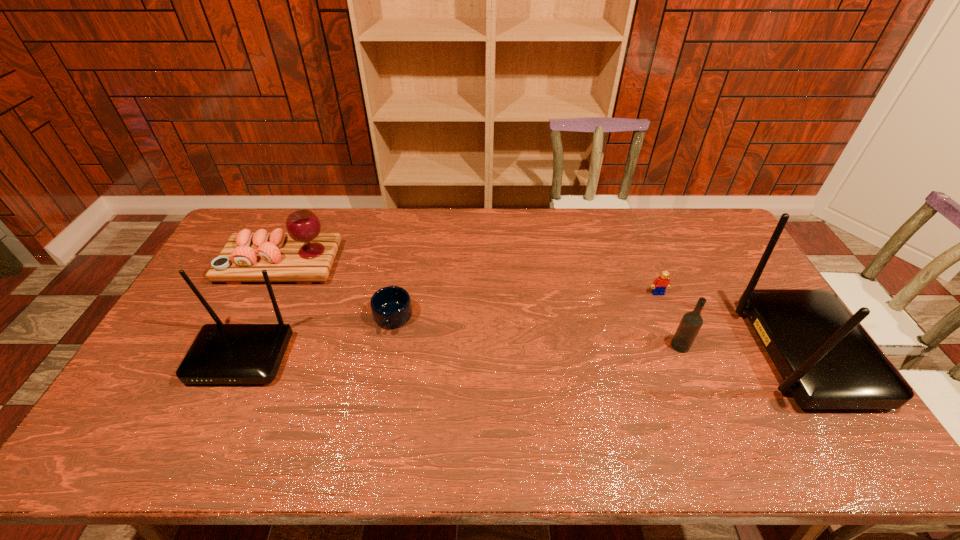
The height and width of the screenshot is (540, 960). What are the coordinates of `free space located 0.070m on the front-facing side of the left router` in the screenshot? It's located at (216, 411).

Where is `vacant space located with the handle on the side of the shortest object`? vacant space located with the handle on the side of the shortest object is located at coordinates (385, 360).

You are a GUI agent. You are given a task and a screenshot of the screen. Output one action in this format:
    pyautogui.click(x=<x>, y=<y>)
    Task: Click on the vacant space situated 0.060m on the front-facing side of the fifth nearest object
    
    Given the screenshot: What is the action you would take?
    pyautogui.click(x=664, y=310)

At what (x,y) coordinates should I click in order to perform the action: click on free point located on the left of the vodka. Please return your answer as a coordinate pair (x, y). Looking at the image, I should click on (647, 346).

Locate an element on the screen. vacant position located on the right of the platter is located at coordinates (399, 263).

Where is `object located at the far edge`? Image resolution: width=960 pixels, height=540 pixels. object located at the far edge is located at coordinates (304, 255).

This screenshot has height=540, width=960. Identify the location of router at the left edge. (221, 353).

Where is `platter at the left edge`? platter at the left edge is located at coordinates (304, 255).

Find the location of a particular element. object present at the right edge is located at coordinates (827, 360).

At what (x,y) coordinates should I click in order to perform the action: click on object situated at the far left corner. Please return your answer as a coordinate pair (x, y). This screenshot has height=540, width=960. Looking at the image, I should click on (304, 255).